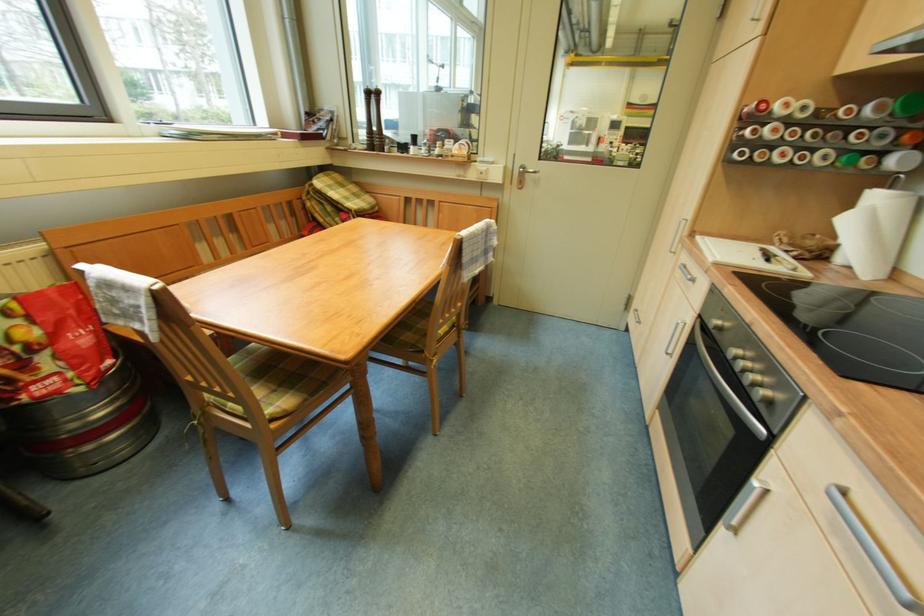
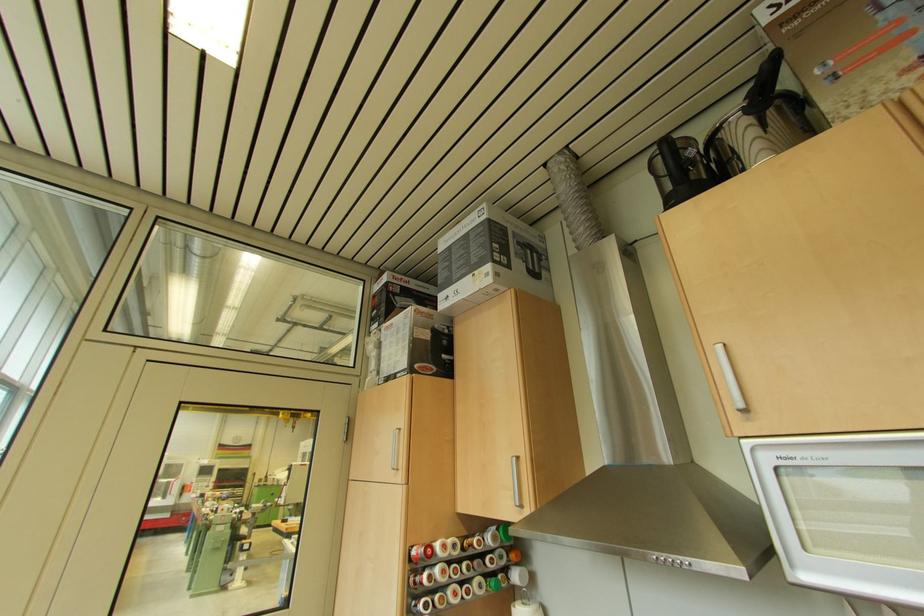
Where in the second image is the point corresponding to point 849,73 from the first image?

(468, 513)